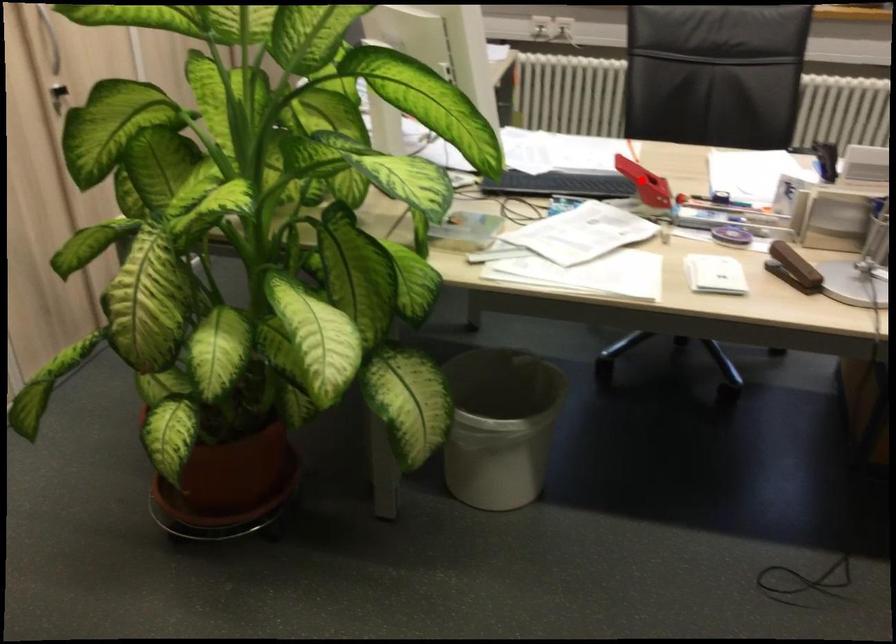
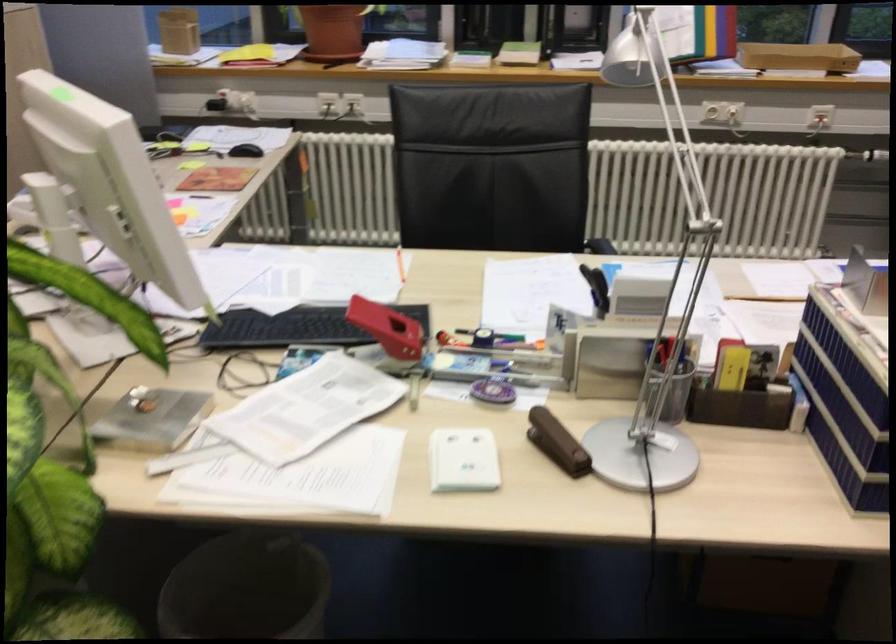
Question: I am providing you with two images of the same scene from different viewpoints. A red point is marked on the first image. At the location where the point appears in image 1, is it still visible in image 2?

Choices:
 (A) Yes
 (B) No

Answer: (A)